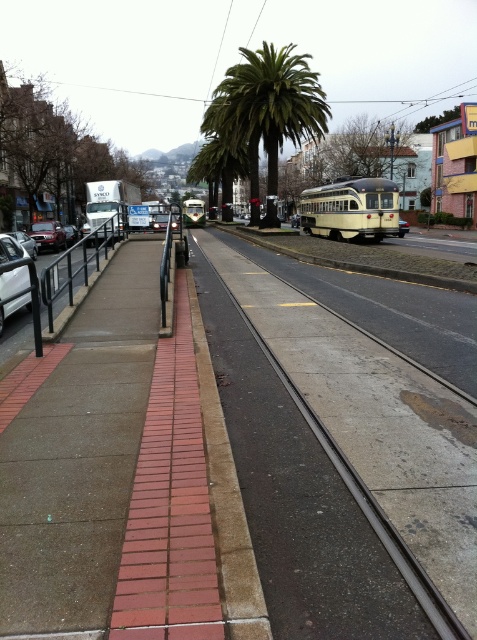
Looking at this image, which is more to the left, concrete track at center or shiny silver sedan at left?

shiny silver sedan at left

Does concrete track at center have a lesser width compared to shiny silver sedan at left?

Correct, concrete track at center's width is less than shiny silver sedan at left's.

Is point (435, 424) positioned after point (64, 241)?

No, (435, 424) is closer to viewer.

Image resolution: width=477 pixels, height=640 pixels. In order to click on concrete track at center in this screenshot , I will do `click(341, 464)`.

Is point (257, 612) less distant than point (0, 250)?

Yes, point (257, 612) is in front of point (0, 250).

Who is lower down, brick at center or white matte car at left?

brick at center is lower down.

You are a GUI agent. You are given a task and a screenshot of the screen. Output one action in this format:
    pyautogui.click(x=<x>, y=<y>)
    Task: Click on the brick at center
    The width and height of the screenshot is (477, 640).
    Given the screenshot: What is the action you would take?
    pyautogui.click(x=227, y=500)

Does concrete track at center have a lesser width compared to white matte car at left?

In fact, concrete track at center might be wider than white matte car at left.

Does concrete track at center have a lesser height compared to white matte car at left?

Incorrect, concrete track at center's height does not fall short of white matte car at left's.

Is point (290, 429) positioned behind point (6, 252)?

No, it is not.

Find the location of a particular element. The width and height of the screenshot is (477, 640). concrete track at center is located at coordinates (341, 464).